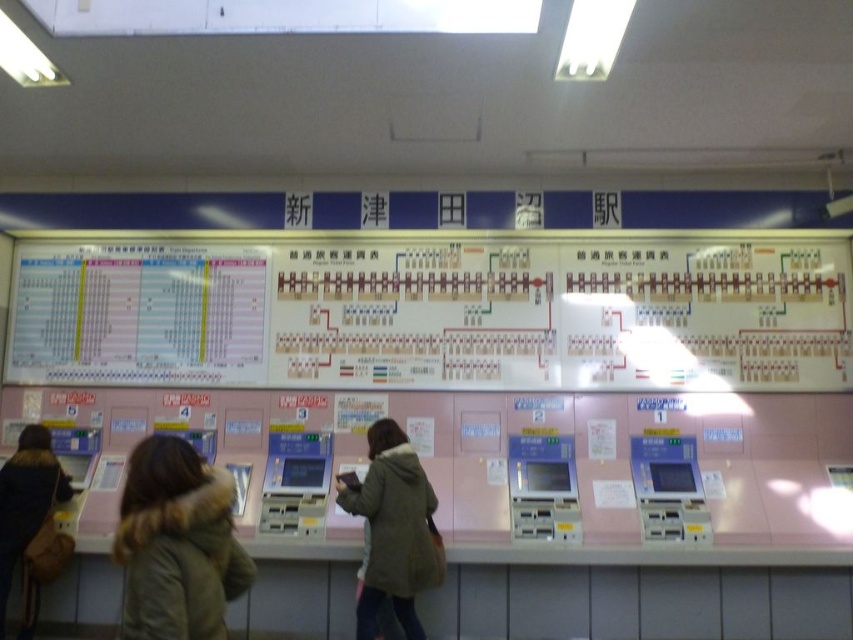
Is point (222, 556) closer to camera compared to point (21, 461)?

Yes, point (222, 556) is closer to viewer.

Looking at this image, does brown fur-lined coat at lower left appear over light brown fur coat at lower left?

Indeed, brown fur-lined coat at lower left is positioned over light brown fur coat at lower left.

What do you see at coordinates (177, 544) in the screenshot? I see `brown fur-lined coat at lower left` at bounding box center [177, 544].

This screenshot has width=853, height=640. In order to click on brown fur-lined coat at lower left in this screenshot , I will do `click(177, 544)`.

How distant is brown fur-lined coat at lower left from green fuzzy coat at center?

brown fur-lined coat at lower left and green fuzzy coat at center are 1.48 meters apart from each other.

Does brown fur-lined coat at lower left appear over green fuzzy coat at center?

Yes, brown fur-lined coat at lower left is above green fuzzy coat at center.

Does point (177, 620) lie in front of point (376, 481)?

Yes, it is in front of point (376, 481).

Locate an element on the screen. brown fur-lined coat at lower left is located at coordinates (177, 544).

Does white paper at center lie in front of light brown fur coat at lower left?

No, white paper at center is behind light brown fur coat at lower left.

Between point (271, 324) and point (19, 481), which one is positioned behind?

Point (271, 324)

Locate an element on the screen. This screenshot has height=640, width=853. white paper at center is located at coordinates (434, 314).